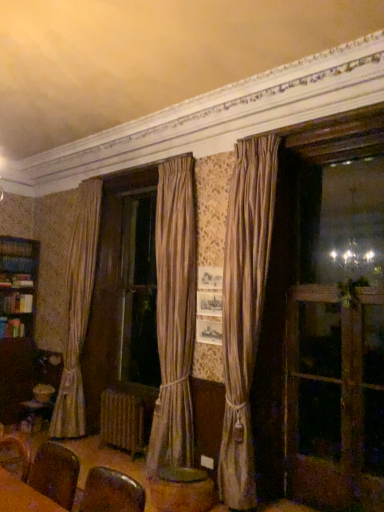
Question: Does wooden round table at center have a lesser height compared to wooden screen door at right?

Choices:
 (A) yes
 (B) no

Answer: (A)

Question: Considering the relative sizes of wooden round table at center and wooden screen door at right in the image provided, is wooden round table at center wider than wooden screen door at right?

Choices:
 (A) yes
 (B) no

Answer: (A)

Question: Is wooden round table at center further to camera compared to wooden screen door at right?

Choices:
 (A) yes
 (B) no

Answer: (A)

Question: Considering the relative sizes of wooden round table at center and wooden screen door at right in the image provided, is wooden round table at center bigger than wooden screen door at right?

Choices:
 (A) no
 (B) yes

Answer: (A)

Question: From a real-world perspective, is wooden round table at center located beneath wooden screen door at right?

Choices:
 (A) no
 (B) yes

Answer: (B)

Question: From a real-world perspective, is wooden round table at center physically located above or below wooden screen door at right?

Choices:
 (A) below
 (B) above

Answer: (A)

Question: Considering the positions of point (170, 490) and point (362, 351), is point (170, 490) closer or farther from the camera than point (362, 351)?

Choices:
 (A) farther
 (B) closer

Answer: (B)

Question: Considering the positions of wooden round table at center and wooden screen door at right in the image, is wooden round table at center bigger or smaller than wooden screen door at right?

Choices:
 (A) small
 (B) big

Answer: (A)

Question: Choose the correct answer: Is wooden round table at center inside wooden screen door at right or outside it?

Choices:
 (A) inside
 (B) outside

Answer: (B)

Question: Is white textured radiator at lower center taller or shorter than silky beige curtain at center?

Choices:
 (A) tall
 (B) short

Answer: (B)

Question: From a real-world perspective, is white textured radiator at lower center above or below silky beige curtain at center?

Choices:
 (A) below
 (B) above

Answer: (A)

Question: Looking at the image, does white textured radiator at lower center seem bigger or smaller compared to silky beige curtain at center?

Choices:
 (A) big
 (B) small

Answer: (B)

Question: Is white textured radiator at lower center situated inside silky beige curtain at center or outside?

Choices:
 (A) inside
 (B) outside

Answer: (B)

Question: Does point (269, 242) appear closer or farther from the camera than point (314, 478)?

Choices:
 (A) closer
 (B) farther

Answer: (B)

Question: From a real-world perspective, is silky beige curtain at center physically located above or below wooden screen door at right?

Choices:
 (A) above
 (B) below

Answer: (A)